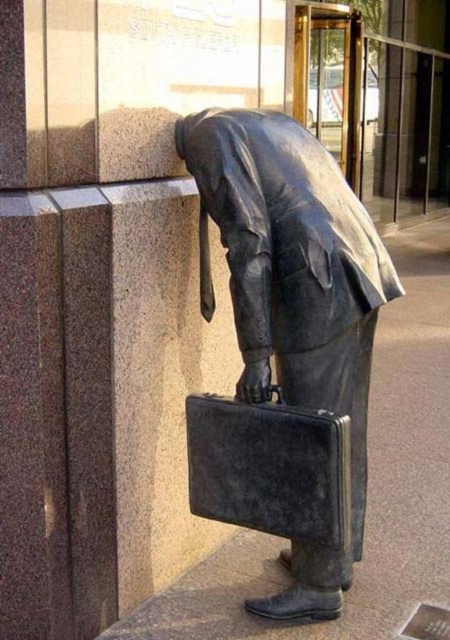
You are standing in front of a modern building with a statue. The statue is at the point marked by coordinates (x=293, y=298). If you want to take a photo of the statue from the front, where should you position yourself relative to the statue?

The point marked by coordinates (x=293, y=298) indicates the location of the bronze statue at center. To take a photo from the front, you should position yourself directly in front of the bronze statue at center, facing its face or main features.

You are an art curator planning to move the bronze statue at center and the black leather briefcase at center to a new exhibition space. The new space has a height restriction of 2 meters. Can both items be moved without any modifications?

The bronze statue at center is bigger than the black leather briefcase at center, but the exact dimensions are not provided. Without knowing the specific height of the statue, it is impossible to determine if it will fit within the 2 meter height restriction.

You are a tour guide leading a group near the bronze statue at center and the black leather briefcase at center. You want to place a small plaque between them. Is there enough space for the plaque which is 25 centimeters long?

The bronze statue at center is 26.15 centimeters away from the black leather briefcase at center. Since the plaque is 25 centimeters long, it can fit between them with about 1.15 centimeters of space remaining.